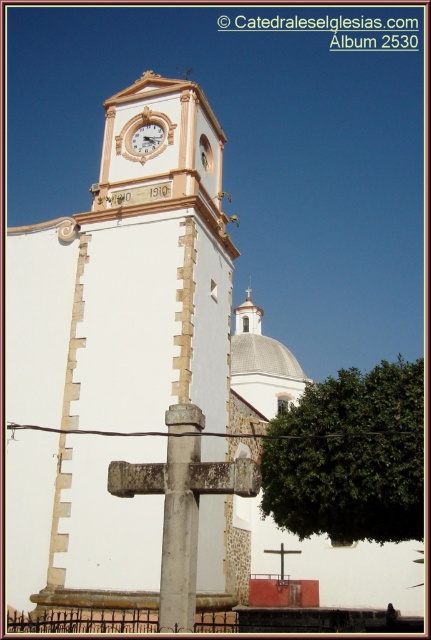
Question: Considering the relative positions of green leafy tree at center and white painted wood clock at upper center in the image provided, where is green leafy tree at center located with respect to white painted wood clock at upper center?

Choices:
 (A) left
 (B) right

Answer: (B)

Question: Is green leafy tree at center wider than white wooden clock at upper center?

Choices:
 (A) yes
 (B) no

Answer: (A)

Question: Which point is closer to the camera?

Choices:
 (A) (143, 109)
 (B) (306, 406)

Answer: (B)

Question: Which object appears closest to the camera in this image?

Choices:
 (A) white wooden clock at upper center
 (B) white painted wood clock at upper center
 (C) green leafy tree at center

Answer: (C)

Question: Can you confirm if white painted wood clock at upper center is smaller than white wooden clock at upper center?

Choices:
 (A) no
 (B) yes

Answer: (A)

Question: Which of the following is the closest to the observer?

Choices:
 (A) green leafy tree at center
 (B) white painted wood clock at upper center

Answer: (A)